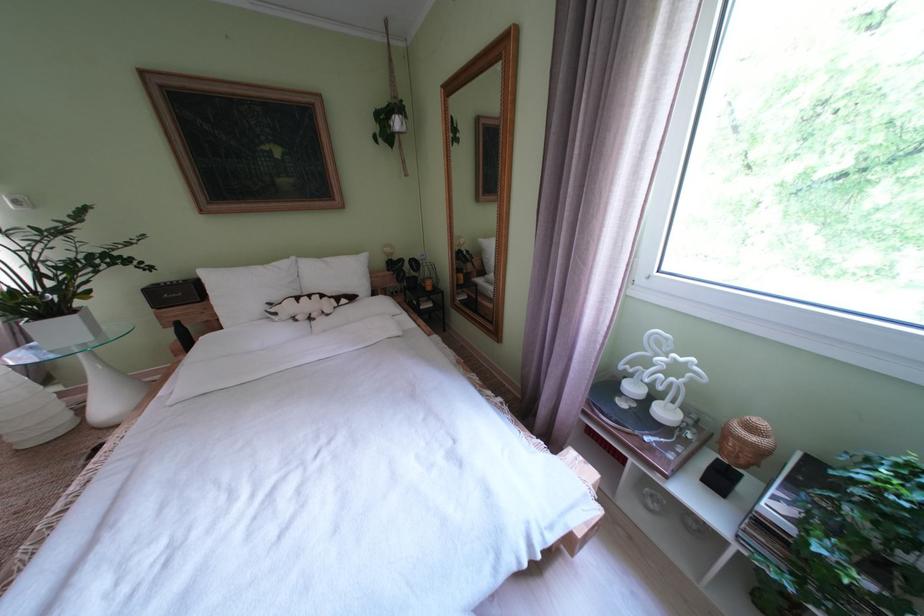
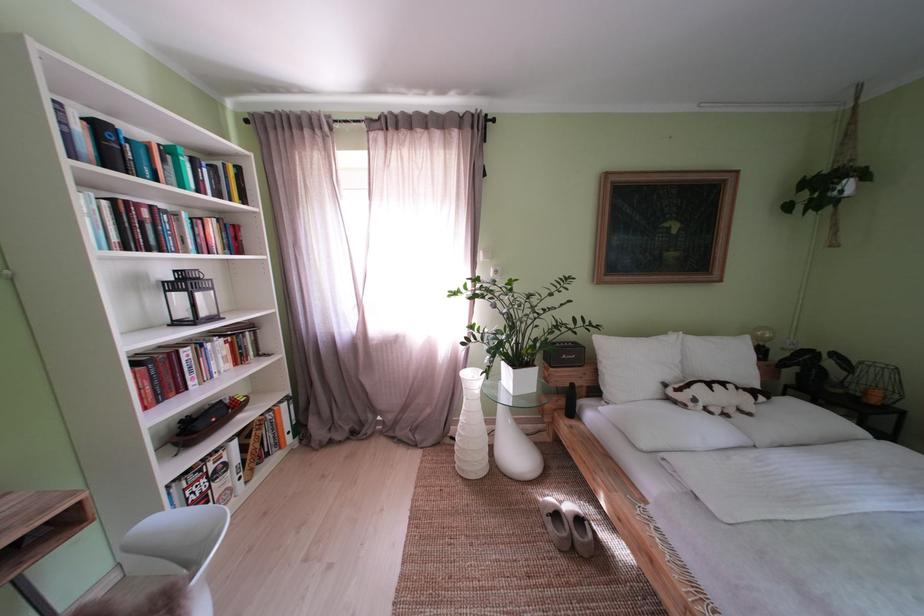
In the second image, find the point that corresponds to [339,264] in the first image.

(723, 344)